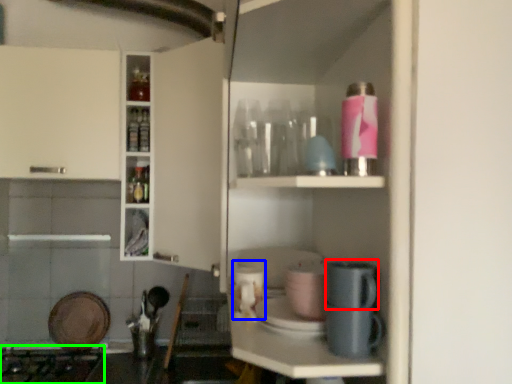
Question: Which object is the farthest from appliance (highlighted by a red box)? Choose among these: appliance (highlighted by a blue box) or gas stove (highlighted by a green box).

Choices:
 (A) appliance
 (B) gas stove

Answer: (B)